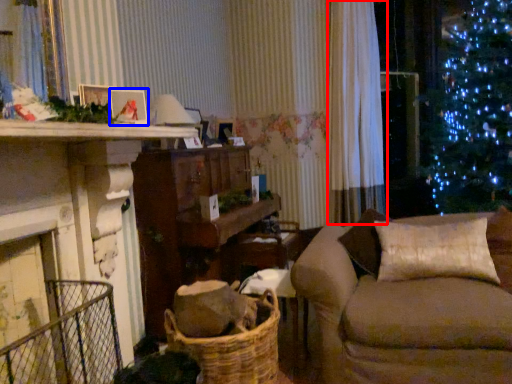
Question: Which of the following is the farthest to the observer, curtain (highlighted by a red box) or picture frame (highlighted by a blue box)?

Choices:
 (A) curtain
 (B) picture frame

Answer: (A)